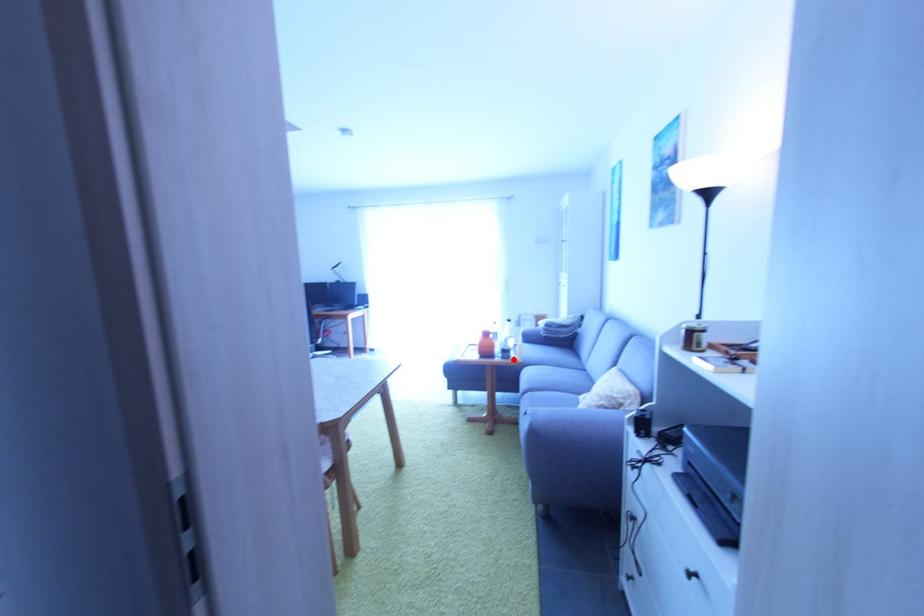
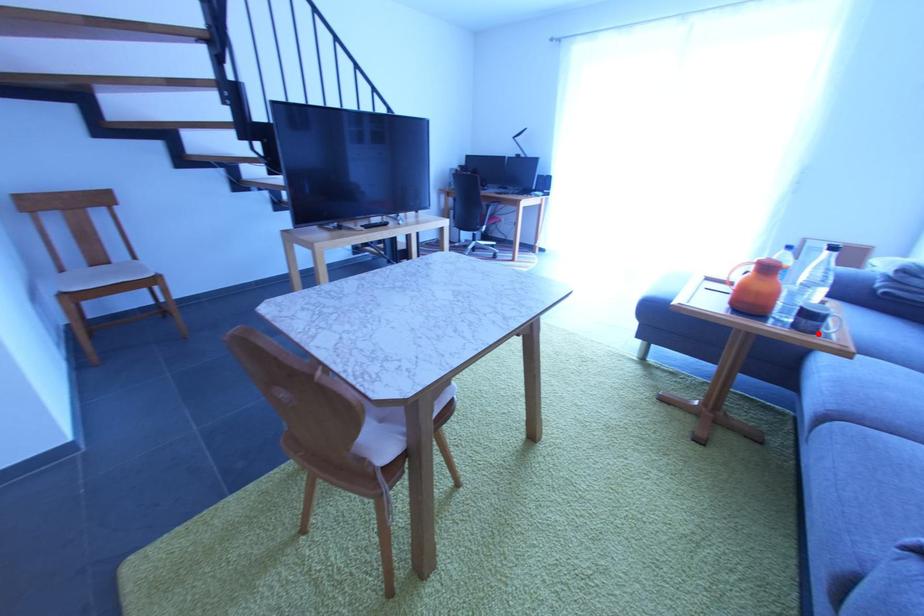
I am providing you with two images of the same scene from different viewpoints. A red point is marked on the first image and another point is marked on the second image. Does the point marked in image1 correspond to the same location as the one in image2?

Yes